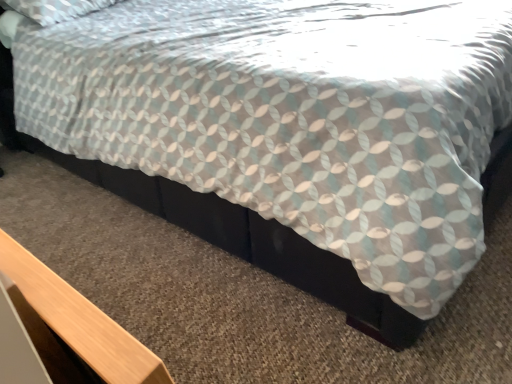
I want to click on light wood table at lower left, so click(80, 321).

What do you see at coordinates (80, 321) in the screenshot? The image size is (512, 384). I see `light wood table at lower left` at bounding box center [80, 321].

Where is `black matte bed frame at lower center`? This screenshot has width=512, height=384. black matte bed frame at lower center is located at coordinates (253, 244).

Describe the element at coordinates (253, 244) in the screenshot. I see `black matte bed frame at lower center` at that location.

This screenshot has height=384, width=512. What are the coordinates of `light wood table at lower left` in the screenshot? It's located at (80, 321).

Between black matte bed frame at lower center and light wood table at lower left, which one appears on the left side from the viewer's perspective?

From the viewer's perspective, light wood table at lower left appears more on the left side.

Which object is closer to the camera, black matte bed frame at lower center or light wood table at lower left?

light wood table at lower left is in front.

Which point is more forward, (272, 230) or (70, 296)?

The point (70, 296) is closer to the camera.

From the image's perspective, is black matte bed frame at lower center above light wood table at lower left?

Correct, black matte bed frame at lower center appears higher than light wood table at lower left in the image.

From a real-world perspective, is black matte bed frame at lower center physically located above or below light wood table at lower left?

From a real-world perspective, black matte bed frame at lower center is physically below light wood table at lower left.

Which of these two, black matte bed frame at lower center or light wood table at lower left, is thinner?

With smaller width is light wood table at lower left.

Considering the sizes of objects black matte bed frame at lower center and light wood table at lower left in the image provided, who is shorter, black matte bed frame at lower center or light wood table at lower left?

With less height is black matte bed frame at lower center.

Considering the sizes of black matte bed frame at lower center and light wood table at lower left in the image, is black matte bed frame at lower center bigger or smaller than light wood table at lower left?

black matte bed frame at lower center is bigger than light wood table at lower left.

Would you say black matte bed frame at lower center is outside light wood table at lower left?

black matte bed frame at lower center lies outside light wood table at lower left's area.

In the scene shown: Is black matte bed frame at lower center far away from light wood table at lower left?

No, black matte bed frame at lower center is in close proximity to light wood table at lower left.

Does black matte bed frame at lower center turn towards light wood table at lower left?

No.

This screenshot has width=512, height=384. Find the location of `table that appears on the left of black matte bed frame at lower center`. table that appears on the left of black matte bed frame at lower center is located at coordinates (80, 321).

Visually, is light wood table at lower left positioned to the left or to the right of black matte bed frame at lower center?

Clearly, light wood table at lower left is on the left of black matte bed frame at lower center in the image.

Which object is closer to the camera taking this photo, light wood table at lower left or black matte bed frame at lower center?

light wood table at lower left is closer to the camera.

Which is nearer, (120, 350) or (357, 306)?

Point (120, 350) is closer to the camera than point (357, 306).

From the image's perspective, does light wood table at lower left appear higher than black matte bed frame at lower center?

No, from the image's perspective, light wood table at lower left is not above black matte bed frame at lower center.

In the scene shown: From a real-world perspective, is light wood table at lower left physically above black matte bed frame at lower center?

Yes, from a real-world perspective, light wood table at lower left is on top of black matte bed frame at lower center.

Is light wood table at lower left wider or thinner than black matte bed frame at lower center?

Considering their sizes, light wood table at lower left looks slimmer than black matte bed frame at lower center.

Does light wood table at lower left have a greater height compared to black matte bed frame at lower center?

Correct, light wood table at lower left is much taller as black matte bed frame at lower center.

Who is smaller, light wood table at lower left or black matte bed frame at lower center?

light wood table at lower left is smaller.

Can we say light wood table at lower left lies outside black matte bed frame at lower center?

That's correct, light wood table at lower left is outside of black matte bed frame at lower center.

Is light wood table at lower left next to black matte bed frame at lower center and touching it?

No, light wood table at lower left is not next to black matte bed frame at lower center.

Is light wood table at lower left facing towards black matte bed frame at lower center?

Yes, light wood table at lower left is facing black matte bed frame at lower center.

Can you tell me how much light wood table at lower left and black matte bed frame at lower center differ in facing direction?

The angular difference between light wood table at lower left and black matte bed frame at lower center is 180 degrees.

In the image, there is a black matte bed frame at lower center. What are the coordinates of `table below it (from the image's perspective)` in the screenshot? It's located at (80, 321).

Where is `table that is above the black matte bed frame at lower center (from a real-world perspective)`? table that is above the black matte bed frame at lower center (from a real-world perspective) is located at coordinates (80, 321).

Find the location of `bed frame above the light wood table at lower left (from the image's perspective)`. bed frame above the light wood table at lower left (from the image's perspective) is located at coordinates (253, 244).